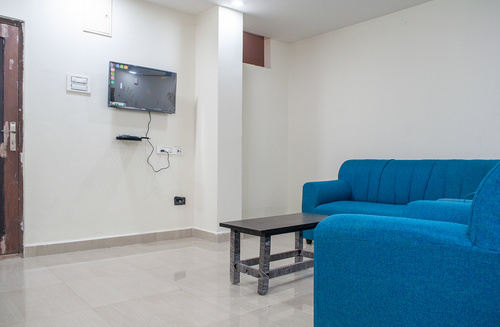
Locate an element on the screen. This screenshot has width=500, height=327. cord is located at coordinates (146, 130).